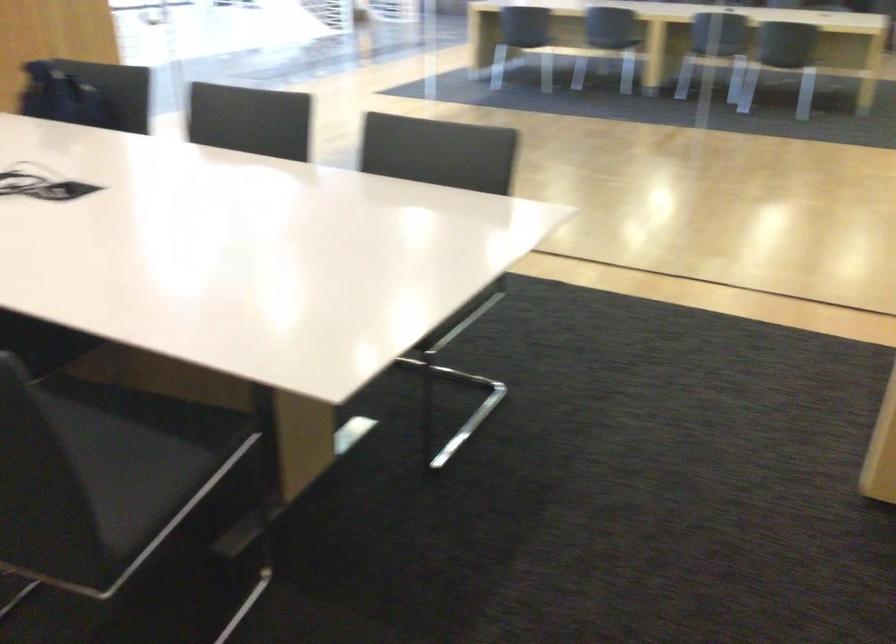
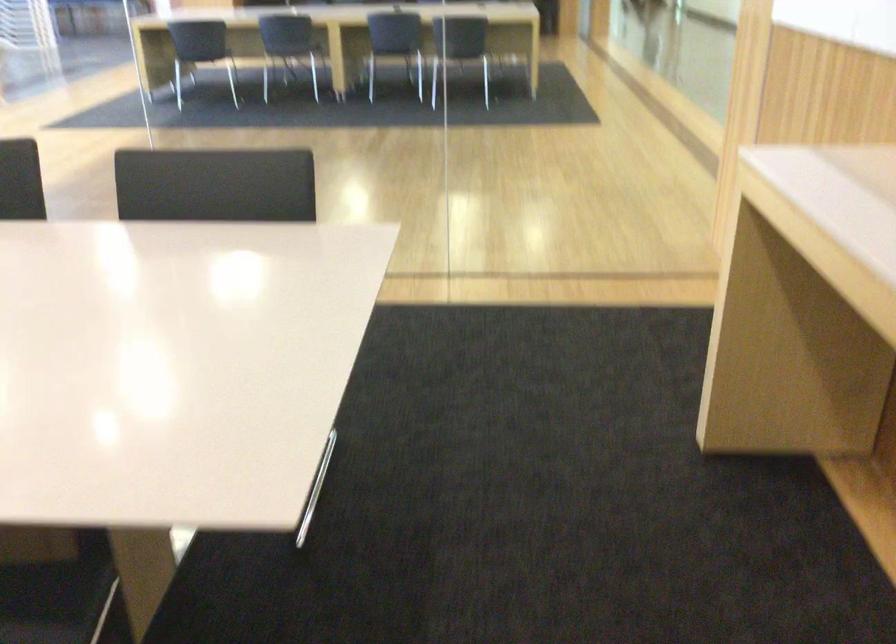
In the second image, find the point that corresponds to point (195, 431) in the first image.

(55, 601)